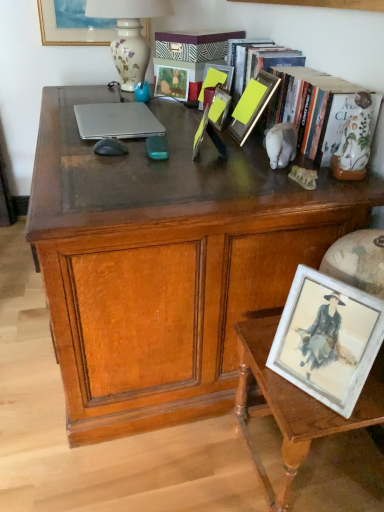
Locate an element on the screen. The width and height of the screenshot is (384, 512). vacant space that's between wooden table at lower right and wooden desk at center is located at coordinates (178, 470).